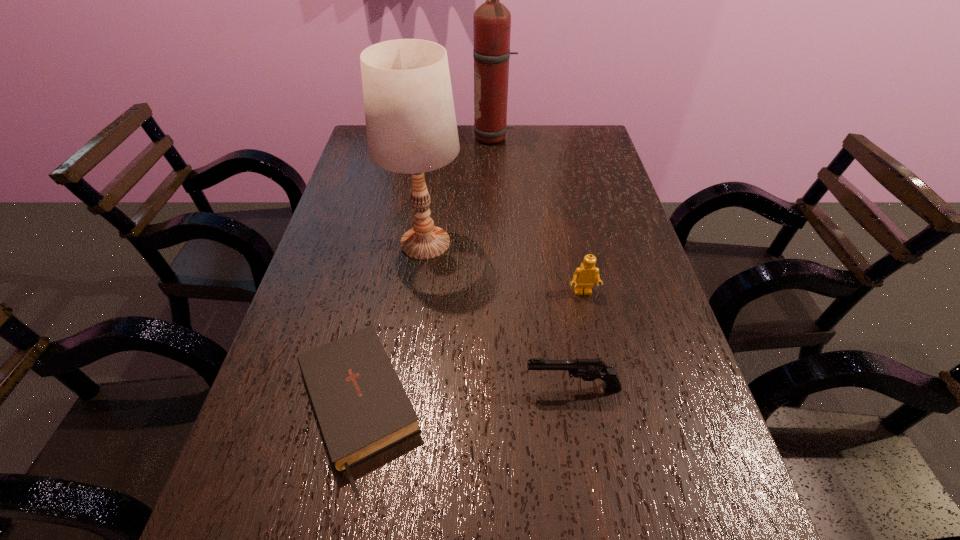
I want to click on vacant region at the right edge of the desktop, so click(x=640, y=318).

Find the location of a particular element. Image resolution: width=960 pixels, height=540 pixels. vacant space at the far left corner is located at coordinates (365, 151).

The width and height of the screenshot is (960, 540). I want to click on vacant space at the far right corner of the desktop, so click(x=578, y=156).

Identify the location of empty space that is in between the fire extinguisher and the Lego. (539, 215).

You are a GUI agent. You are given a task and a screenshot of the screen. Output one action in this format:
    pyautogui.click(x=<x>, y=<y>)
    Task: Click on the empty location between the fire extinguisher and the gun
    
    Given the screenshot: What is the action you would take?
    pyautogui.click(x=533, y=263)

Find the location of `vacant area that lies between the fourth nearest object and the gun`. vacant area that lies between the fourth nearest object and the gun is located at coordinates (499, 315).

Find the location of a particular element. vacant point located between the Lego and the gun is located at coordinates (578, 340).

Find the location of a particular element. empty location between the lamp and the gun is located at coordinates pos(499,315).

You are a GUI agent. You are given a task and a screenshot of the screen. Output one action in this format:
    pyautogui.click(x=<x>, y=<y>)
    Task: Click on the free space between the lamp and the shortest object
    
    Given the screenshot: What is the action you would take?
    pyautogui.click(x=391, y=326)

Where is `free space between the fourth nearest object and the Lego`? free space between the fourth nearest object and the Lego is located at coordinates (504, 268).